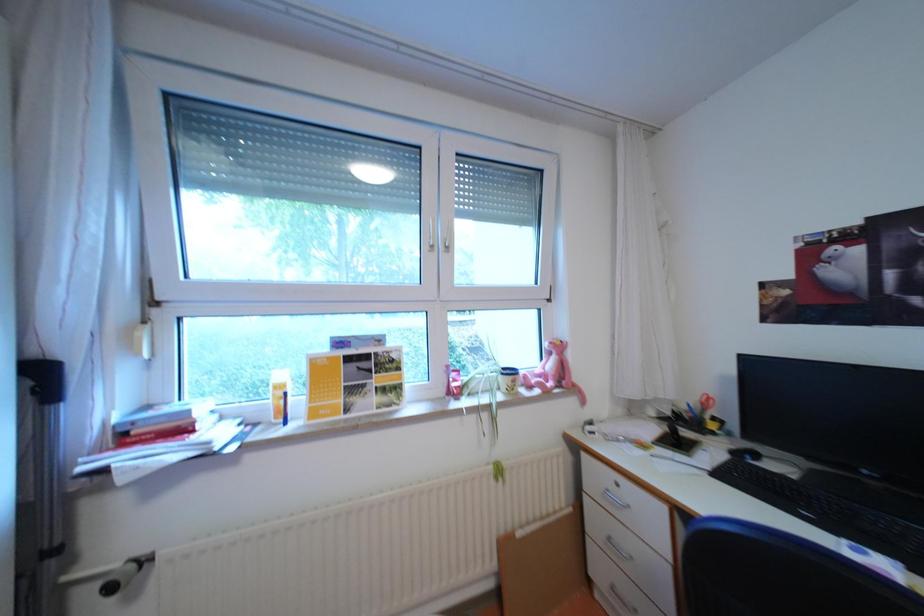
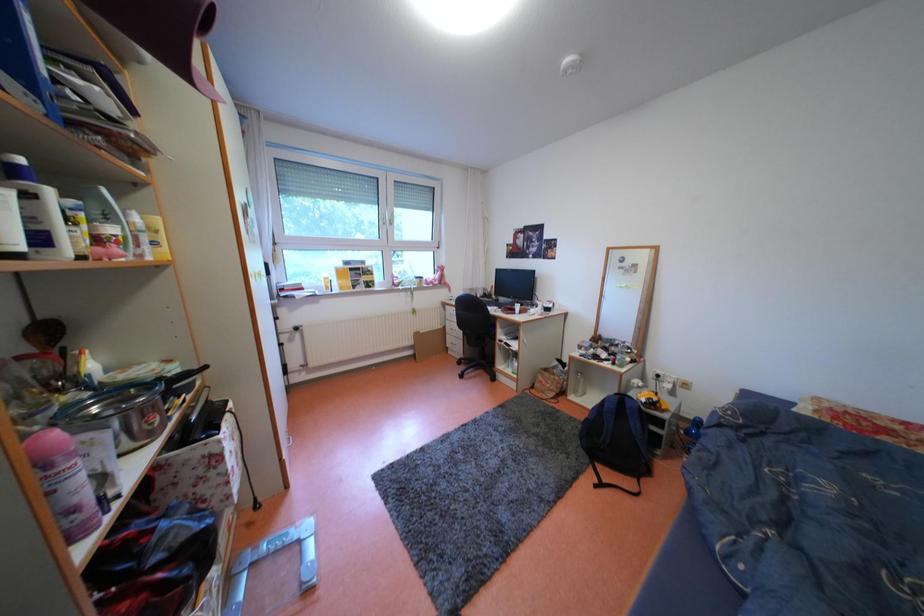
Question: The images are taken continuously from a first-person perspective. In which direction are you moving?

Choices:
 (A) Left
 (B) Right
 (C) Forward
 (D) Backward

Answer: (D)